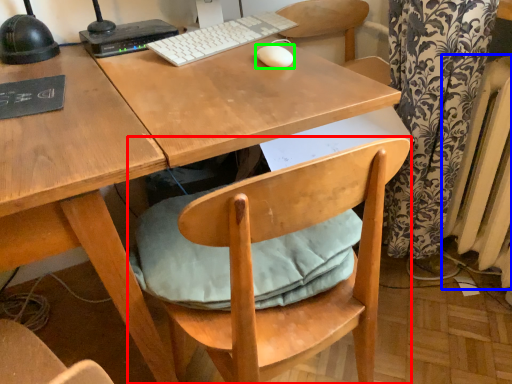
Question: Which is farther away from chair (highlighted by a red box)? radiator (highlighted by a blue box) or mouse (highlighted by a green box)?

Choices:
 (A) radiator
 (B) mouse

Answer: (A)